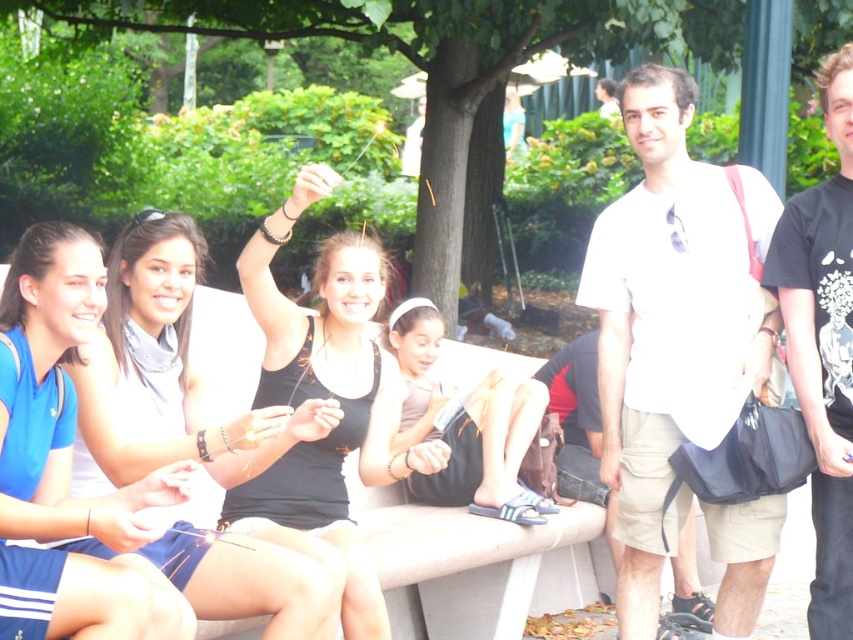
Question: Which point appears farthest from the camera in this image?

Choices:
 (A) (610, 108)
 (B) (824, 449)

Answer: (A)

Question: Is white cotton shirt at center further to the viewer compared to white cotton shirt at upper center?

Choices:
 (A) no
 (B) yes

Answer: (A)

Question: Which point appears farthest from the camera in this image?

Choices:
 (A) (839, 461)
 (B) (705, 227)
 (C) (602, 84)

Answer: (C)

Question: Considering the relative positions of white cotton shirt at center and black cotton t-shirt at center in the image provided, where is white cotton shirt at center located with respect to black cotton t-shirt at center?

Choices:
 (A) right
 (B) left

Answer: (B)

Question: Which of these objects is positioned closest to the white cotton shirt at center?

Choices:
 (A) white cotton shirt at upper center
 (B) black cotton t-shirt at center

Answer: (B)

Question: In this image, where is white cotton shirt at center located relative to black cotton t-shirt at center?

Choices:
 (A) right
 (B) left

Answer: (B)